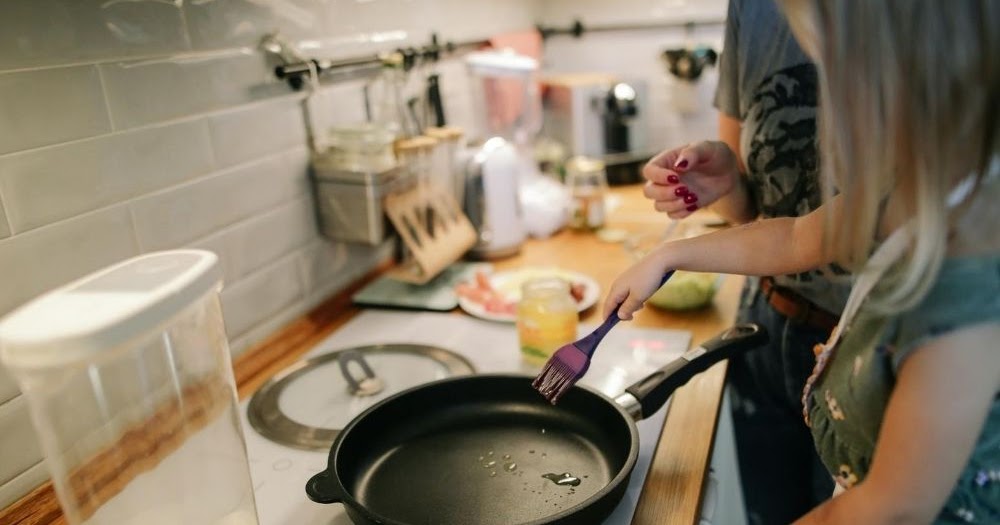
Image resolution: width=1000 pixels, height=525 pixels. What are the coordinates of `water filter` in the screenshot? It's located at (175, 359).